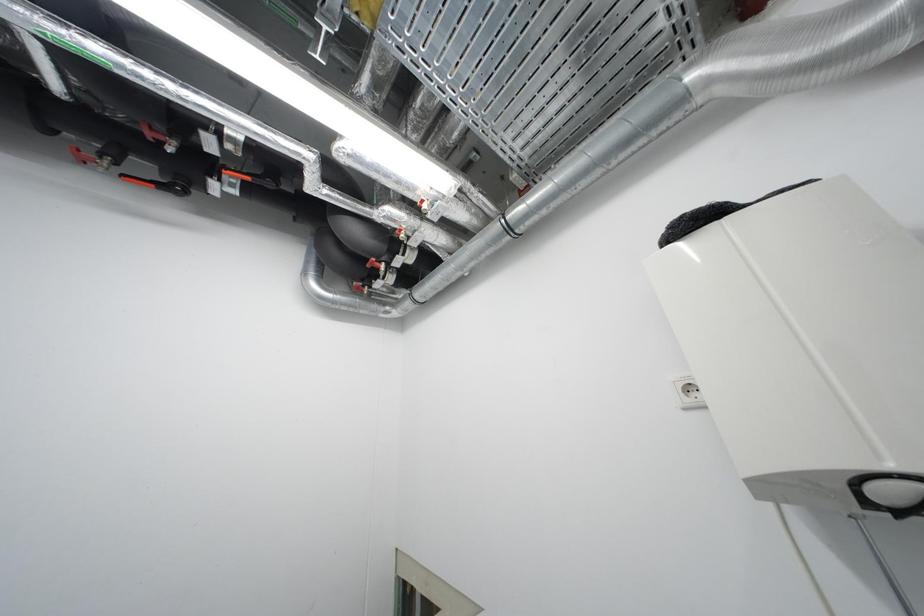
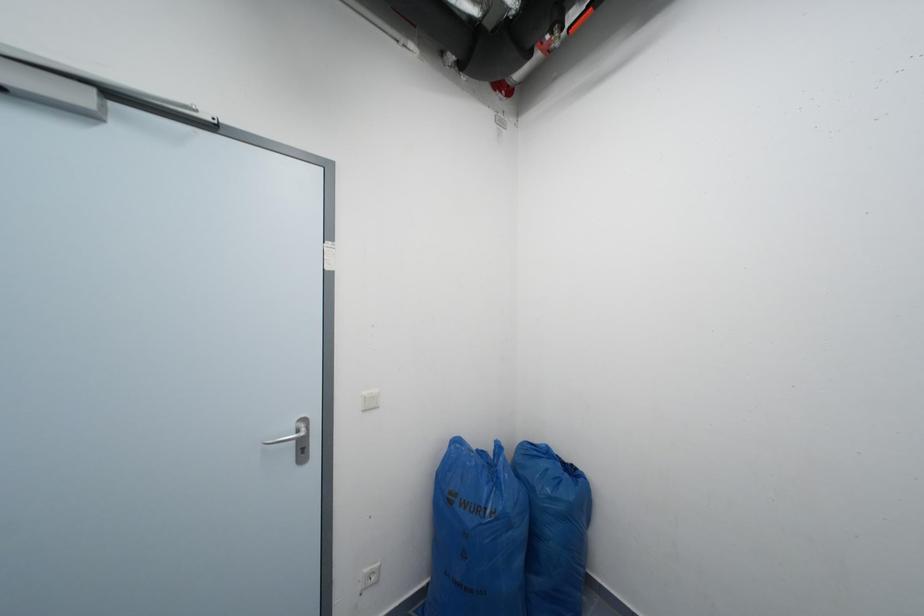
Question: The camera is either moving clockwise (left) or counter-clockwise (right) around the object. The first image is from the beginning of the video and the second image is from the end. Is the camera moving left or right when shooting the video?

Choices:
 (A) Left
 (B) Right

Answer: (B)